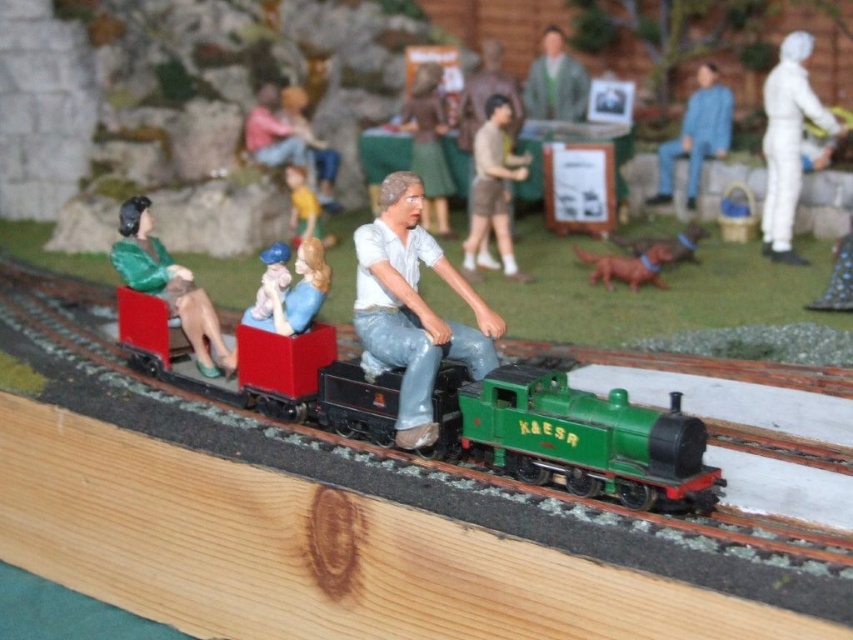
You are a GUI agent. You are given a task and a screenshot of the screen. Output one action in this format:
    pyautogui.click(x=<x>, y=<y>)
    Task: Click on the green matte train at center
    The height and width of the screenshot is (640, 853).
    Given the screenshot: What is the action you would take?
    pyautogui.click(x=573, y=438)

Who is lower down, green matte train at center or smooth beige figurine at center?

Positioned lower is green matte train at center.

Which is in front, point (309, 410) or point (426, 218)?

Point (309, 410) is in front.

Where is `green matte train at center`? This screenshot has width=853, height=640. green matte train at center is located at coordinates (573, 438).

Between brown matte shorts at center and smooth yellow toy at center, which one has more height?

With more height is brown matte shorts at center.

Between point (492, 218) and point (318, 232), which one is positioned in front?

Point (492, 218) is in front.

Identify the location of brown matte shorts at center. The width and height of the screenshot is (853, 640). (492, 186).

What do you see at coordinates (492, 186) in the screenshot?
I see `brown matte shorts at center` at bounding box center [492, 186].

This screenshot has width=853, height=640. Find the location of `brown matte shorts at center`. brown matte shorts at center is located at coordinates (492, 186).

Image resolution: width=853 pixels, height=640 pixels. Identify the location of brown matte shorts at center. (492, 186).